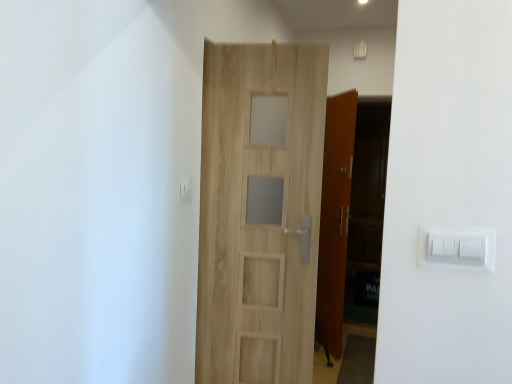
Question: From a real-world perspective, relative to white plastic light switch at upper center, which is the second light switch in bottom-to-top order, is white plastic light switch at right, acting as the first light switch starting from the bottom, vertically above or below?

Choices:
 (A) below
 (B) above

Answer: (A)

Question: From their relative heights in the image, would you say white plastic light switch at right, which appears as the 1th light switch when viewed from the front, is taller or shorter than white plastic light switch at upper center, arranged as the 1th light switch when viewed from the top?

Choices:
 (A) tall
 (B) short

Answer: (A)

Question: Which object is the closest to the white plastic light switch at right, the 2th light switch positioned from the back?

Choices:
 (A) white plastic light switch at upper center, positioned as the second light switch in right-to-left order
 (B) light wood door at center

Answer: (B)

Question: Estimate the real-world distances between objects in this image. Which object is closer to the light wood door at center?

Choices:
 (A) white plastic light switch at upper center, acting as the first light switch starting from the left
 (B) white plastic light switch at right, the 2th light switch positioned from the back

Answer: (A)